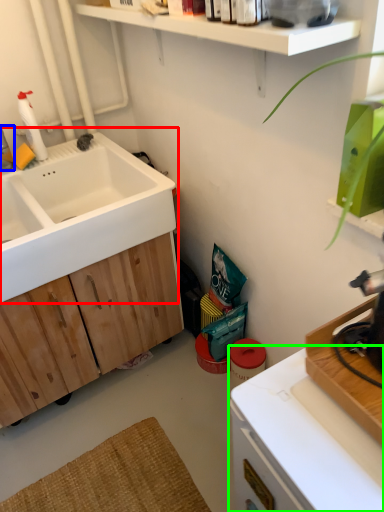
Question: Which object is positioned farthest from sink (highlighted by a red box)? Select from faucet (highlighted by a blue box) and countertop (highlighted by a green box).

Choices:
 (A) faucet
 (B) countertop

Answer: (B)